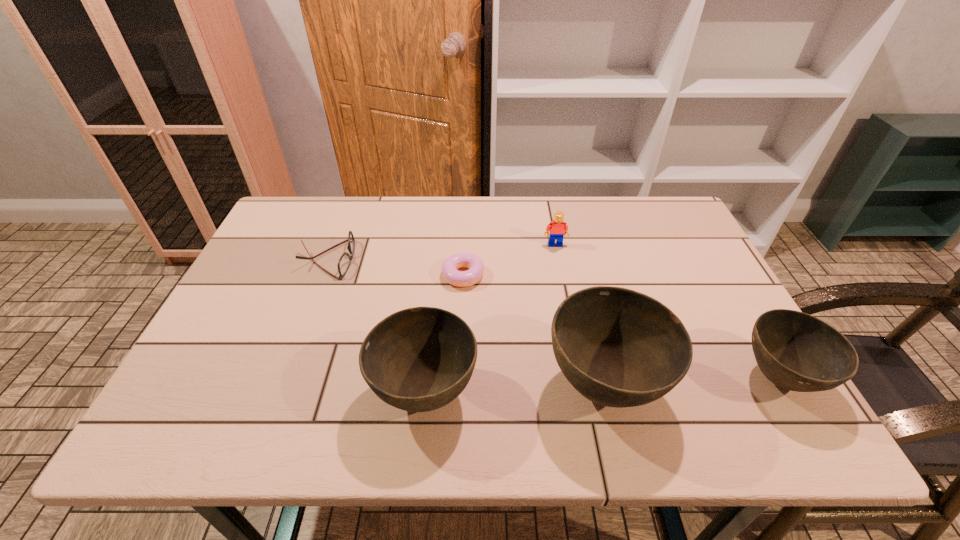
Identify the location of free location that satisfies the following two spatial constraints: 1. on the front-facing side of the shortest bowl; 2. on the right side of the spectacles. The width and height of the screenshot is (960, 540). (280, 379).